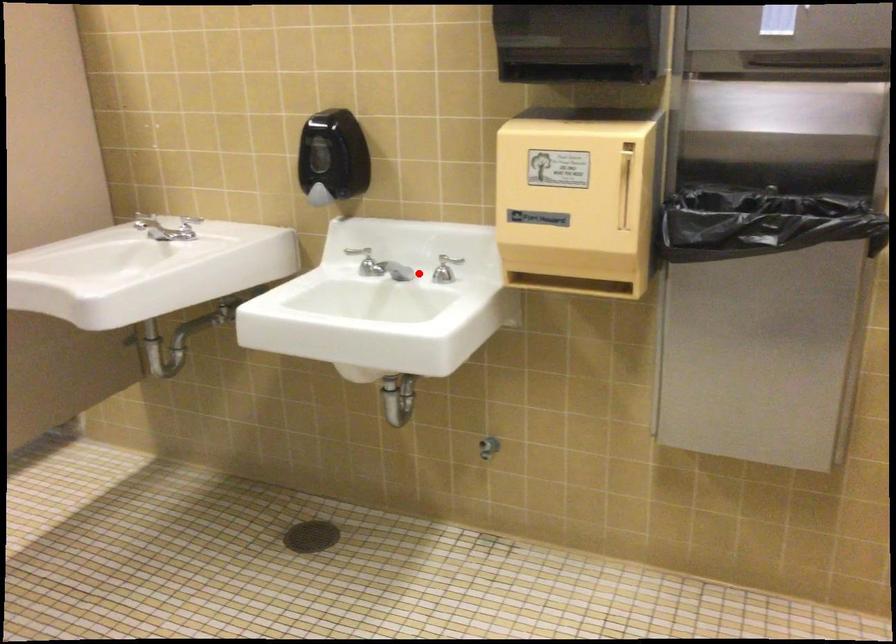
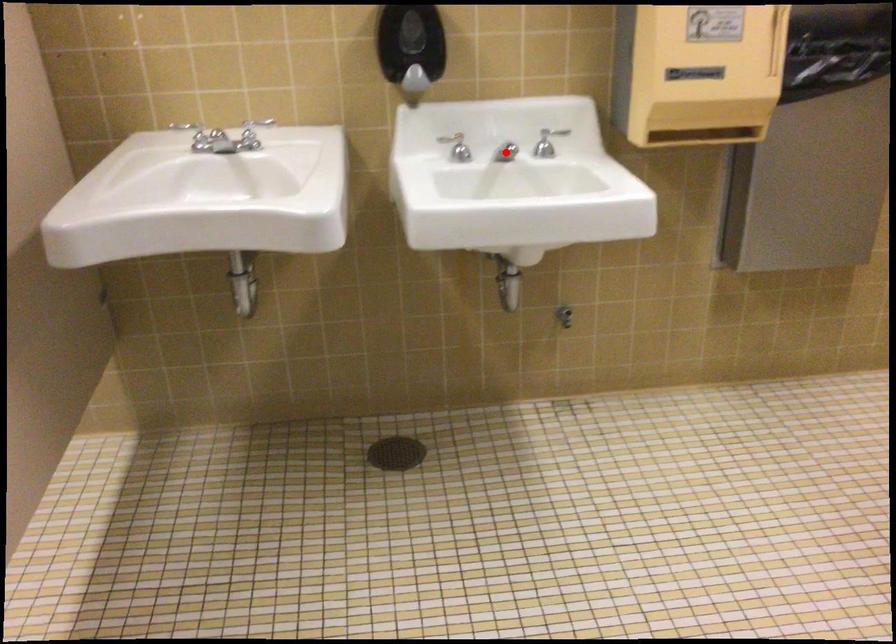
I am providing you with two images of the same scene from different viewpoints. A red point is marked on the first image and another point is marked on the second image. Is the red point in image1 aligned with the point shown in image2?

Yes